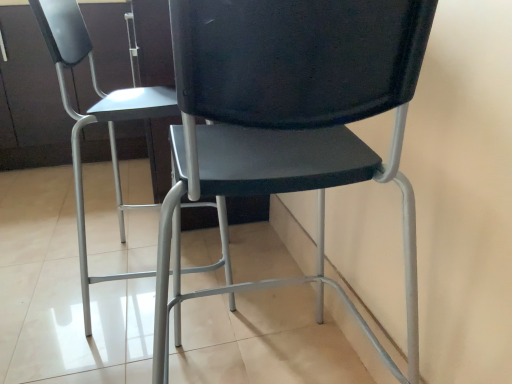
This screenshot has height=384, width=512. I want to click on vacant region to the left of matte black chair at center, the second chair in the right-to-left sequence, so click(54, 270).